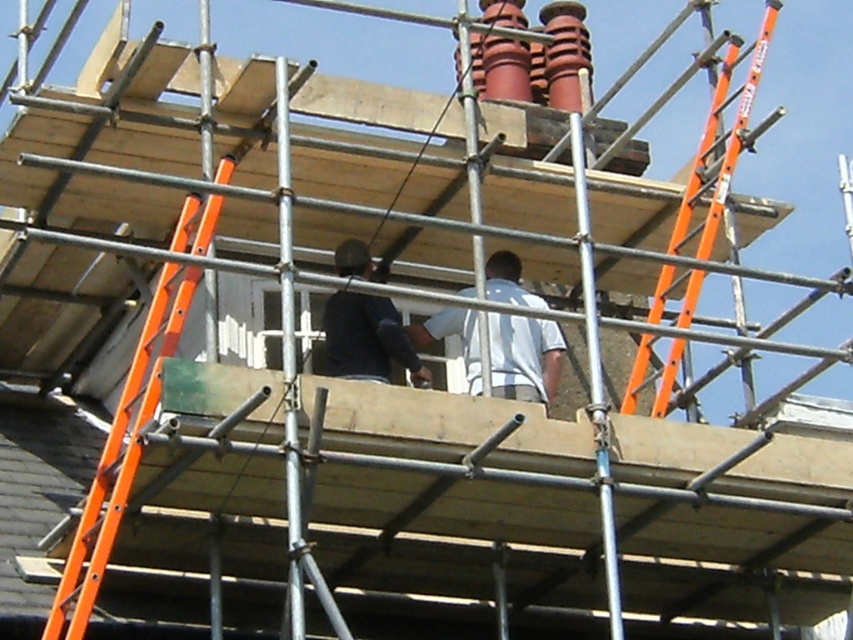
Does orange metallic ladder at left have a lesser height compared to dark blue shirt at center?

Incorrect, orange metallic ladder at left's height does not fall short of dark blue shirt at center's.

Is point (76, 616) farther from camera compared to point (328, 317)?

No, it is not.

Does point (152, 307) come in front of point (343, 269)?

Yes, it is in front of point (343, 269).

Identify the location of orange metallic ladder at left. (120, 454).

Image resolution: width=853 pixels, height=640 pixels. What do you see at coordinates (120, 454) in the screenshot?
I see `orange metallic ladder at left` at bounding box center [120, 454].

From the picture: Is orange metallic ladder at left behind white matte shirt at center?

No, it is in front of white matte shirt at center.

Is point (141, 355) closer to camera compared to point (509, 291)?

Yes, it is.

I want to click on orange metallic ladder at left, so click(x=120, y=454).

Who is positioned more to the left, orange metallic ladder at left or orange fiberglass ladder at right?

Positioned to the left is orange metallic ladder at left.

Does orange metallic ladder at left come behind orange fiberglass ladder at right?

No, it is in front of orange fiberglass ladder at right.

Is point (218, 177) farther from camera compared to point (711, 132)?

No, (218, 177) is closer to viewer.

What are the coordinates of `orange metallic ladder at left` in the screenshot? It's located at (120, 454).